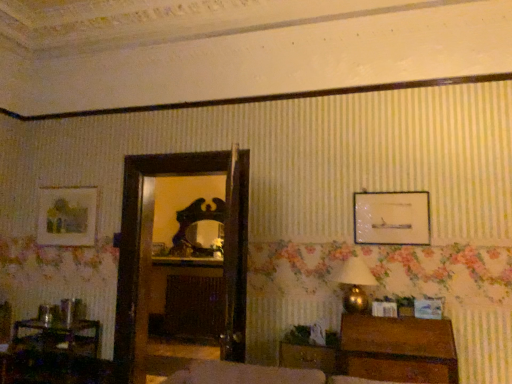
Question: From a real-world perspective, is shiny dark wood mirror at center below gold metallic table lamp at right?

Choices:
 (A) yes
 (B) no

Answer: (B)

Question: From a real-world perspective, does shiny dark wood mirror at center stand above gold metallic table lamp at right?

Choices:
 (A) yes
 (B) no

Answer: (A)

Question: Could you tell me if shiny dark wood mirror at center is facing gold metallic table lamp at right?

Choices:
 (A) no
 (B) yes

Answer: (A)

Question: Is gold metallic table lamp at right at the back of shiny dark wood mirror at center?

Choices:
 (A) yes
 (B) no

Answer: (B)

Question: Considering the relative positions of shiny dark wood mirror at center and gold metallic table lamp at right in the image provided, is shiny dark wood mirror at center behind gold metallic table lamp at right?

Choices:
 (A) no
 (B) yes

Answer: (B)

Question: Is shiny dark wood mirror at center smaller than gold metallic table lamp at right?

Choices:
 (A) yes
 (B) no

Answer: (B)

Question: Considering the relative sizes of gold metallic table lamp at right and wooden table at lower left in the image provided, is gold metallic table lamp at right wider than wooden table at lower left?

Choices:
 (A) yes
 (B) no

Answer: (B)

Question: Is there a large distance between gold metallic table lamp at right and wooden table at lower left?

Choices:
 (A) no
 (B) yes

Answer: (B)

Question: Is gold metallic table lamp at right looking in the opposite direction of wooden table at lower left?

Choices:
 (A) no
 (B) yes

Answer: (A)

Question: From the image's perspective, would you say gold metallic table lamp at right is shown under wooden table at lower left?

Choices:
 (A) yes
 (B) no

Answer: (B)

Question: Is gold metallic table lamp at right placed right next to wooden table at lower left?

Choices:
 (A) yes
 (B) no

Answer: (B)

Question: Is gold metallic table lamp at right shorter than wooden table at lower left?

Choices:
 (A) no
 (B) yes

Answer: (B)

Question: Is matte wooden picture frame at upper left, which is the 3th picture frame from right to left, bigger than wooden chest at lower right?

Choices:
 (A) yes
 (B) no

Answer: (B)